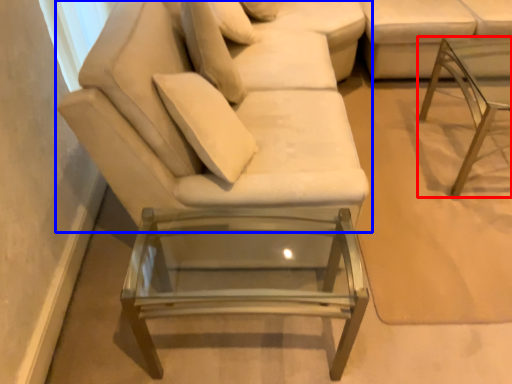
Question: Which object appears farthest to the camera in this image, table (highlighted by a red box) or studio couch (highlighted by a blue box)?

Choices:
 (A) table
 (B) studio couch

Answer: (A)